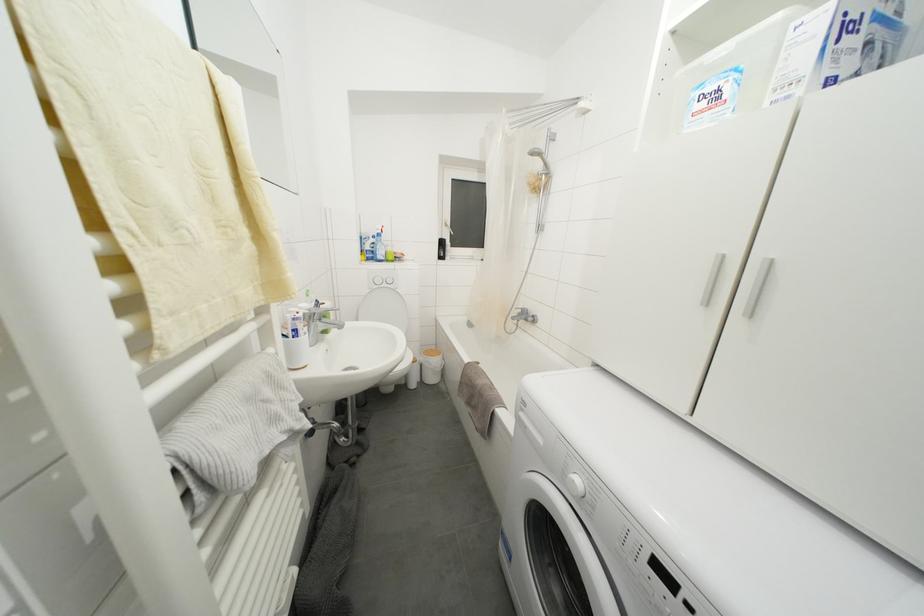
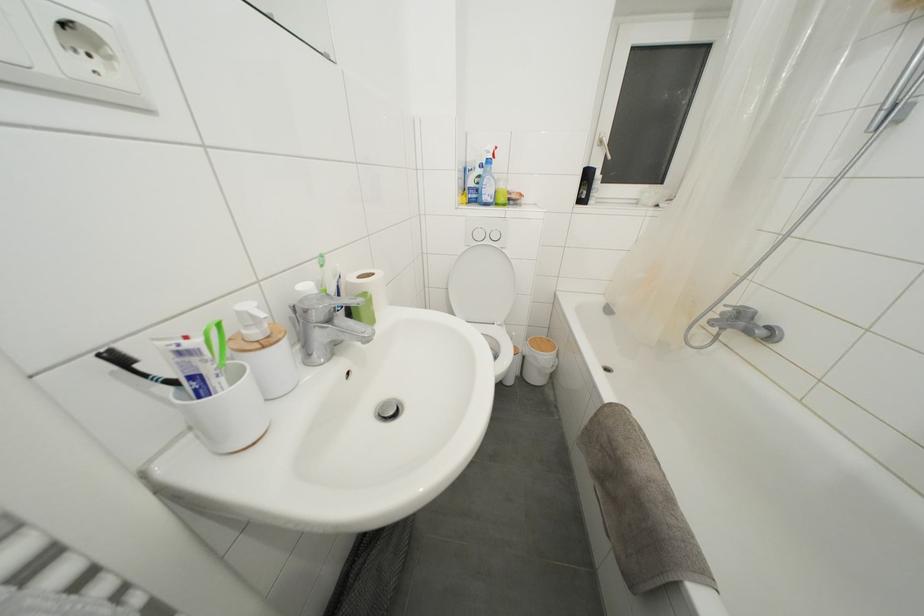
Question: The first image is from the beginning of the video and the second image is from the end. How did the camera likely rotate when shooting the video?

Choices:
 (A) Left
 (B) Right
 (C) Up
 (D) Down

Answer: (A)